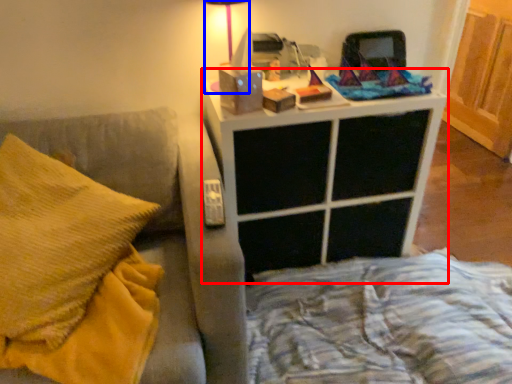
Question: Which of the following is the closest to the observer, nightstand (highlighted by a red box) or table lamp (highlighted by a blue box)?

Choices:
 (A) nightstand
 (B) table lamp

Answer: (A)